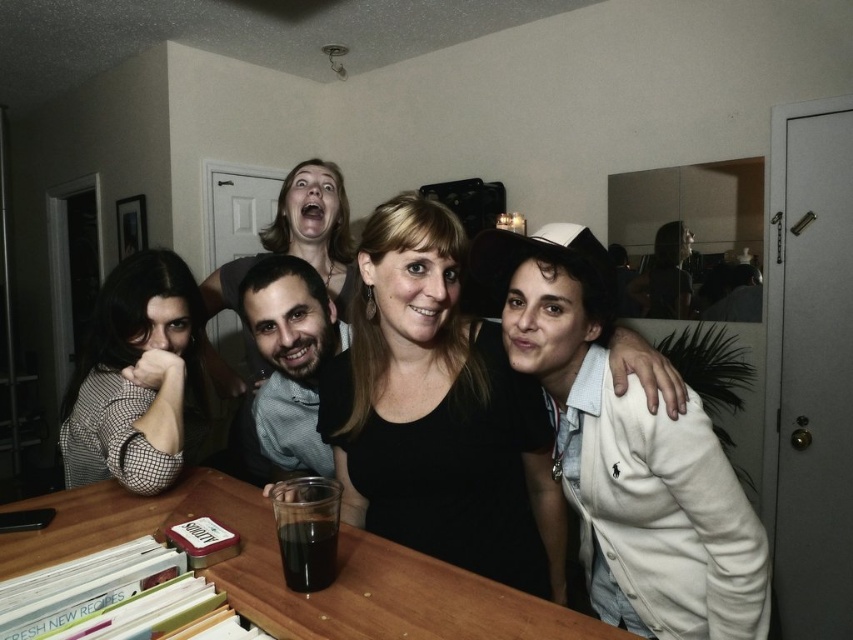
Question: Observing the image, what is the correct spatial positioning of white cotton jacket at right in reference to wooden table at lower center?

Choices:
 (A) left
 (B) right

Answer: (B)

Question: In this image, where is white cotton jacket at right located relative to dark liquid glass at center?

Choices:
 (A) left
 (B) right

Answer: (B)

Question: Which object appears closest to the camera in this image?

Choices:
 (A) matte black hair at upper center
 (B) light brown shirt at center

Answer: (B)

Question: Where is black matte shirt at center located in relation to light brown shirt at center in the image?

Choices:
 (A) above
 (B) below

Answer: (B)

Question: Which object appears farthest from the camera in this image?

Choices:
 (A) wooden table at lower center
 (B) light brown shirt at center
 (C) white cotton jacket at right

Answer: (B)

Question: Considering the real-world distances, which object is closest to the white cotton jacket at right?

Choices:
 (A) matte black hair at upper center
 (B) black checkered shirt at left

Answer: (B)